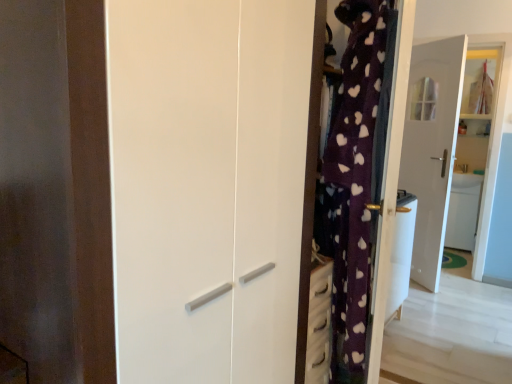
Question: Is white glossy door at center taller than white glossy wardrobe at center?

Choices:
 (A) no
 (B) yes

Answer: (B)

Question: From the image's perspective, is white glossy door at center on top of white glossy wardrobe at center?

Choices:
 (A) yes
 (B) no

Answer: (A)

Question: Is white glossy wardrobe at center at the back of white glossy door at center?

Choices:
 (A) no
 (B) yes

Answer: (A)

Question: Considering the relative sizes of white glossy door at center and white glossy wardrobe at center in the image provided, is white glossy door at center wider than white glossy wardrobe at center?

Choices:
 (A) no
 (B) yes

Answer: (A)

Question: Can you confirm if white glossy door at center is positioned to the right of white glossy wardrobe at center?

Choices:
 (A) no
 (B) yes

Answer: (B)

Question: Is white glossy sink at right inside or outside of white glossy door at center?

Choices:
 (A) outside
 (B) inside

Answer: (A)

Question: Considering the relative positions of white glossy sink at right and white glossy door at center in the image provided, is white glossy sink at right to the left or to the right of white glossy door at center?

Choices:
 (A) right
 (B) left

Answer: (A)

Question: From the image's perspective, is white glossy sink at right positioned above or below white glossy door at center?

Choices:
 (A) above
 (B) below

Answer: (B)

Question: Considering the positions of white glossy sink at right and white glossy door at center in the image, is white glossy sink at right taller or shorter than white glossy door at center?

Choices:
 (A) tall
 (B) short

Answer: (B)

Question: Considering the positions of white glossy door at center and white glossy wardrobe at center in the image, is white glossy door at center taller or shorter than white glossy wardrobe at center?

Choices:
 (A) short
 (B) tall

Answer: (B)

Question: From the image's perspective, is white glossy door at center above or below white glossy wardrobe at center?

Choices:
 (A) below
 (B) above

Answer: (B)

Question: Is point (441, 223) positioned closer to the camera than point (128, 238)?

Choices:
 (A) closer
 (B) farther

Answer: (B)

Question: Is white glossy door at center wider or thinner than white glossy wardrobe at center?

Choices:
 (A) thin
 (B) wide

Answer: (A)

Question: Considering their positions, is white glossy wardrobe at center located in front of or behind white glossy sink at right?

Choices:
 (A) front
 (B) behind

Answer: (A)

Question: In the image, is white glossy wardrobe at center on the left side or the right side of white glossy sink at right?

Choices:
 (A) left
 (B) right

Answer: (A)